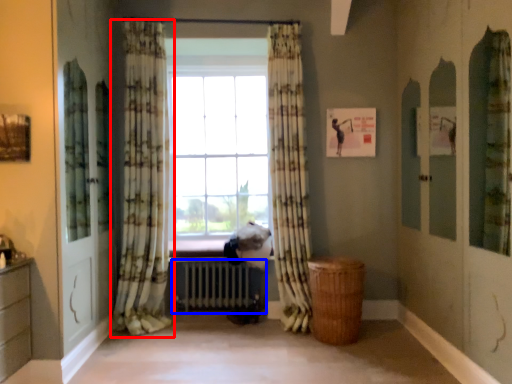
Question: Which point is closer to the camera, curtain (highlighted by a red box) or radiator (highlighted by a blue box)?

Choices:
 (A) curtain
 (B) radiator

Answer: (A)